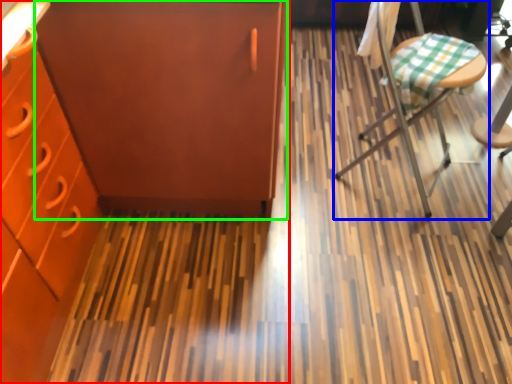
Question: Which object is positioned farthest from cabinetry (highlighted by a red box)? Select from chair (highlighted by a blue box) and file cabinet (highlighted by a green box).

Choices:
 (A) chair
 (B) file cabinet

Answer: (A)